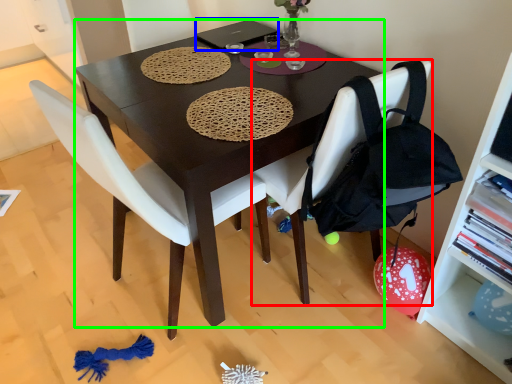
Question: Considering the real-world distances, which object is farthest from chair (highlighted by a red box)? laptop (highlighted by a blue box) or desk (highlighted by a green box)?

Choices:
 (A) laptop
 (B) desk

Answer: (A)